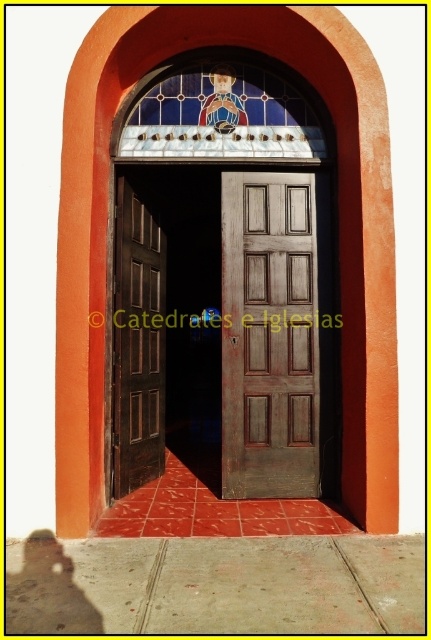
You are standing in front of the cathedral entrance and want to enter through one of the doors. The wooden door at center and the brown wooden door at left are both visible. Which door should you choose if you need to pass through a taller doorway?

The wooden door at center is much taller than the brown wooden door at left, so you should choose the wooden door at center to pass through the taller doorway.